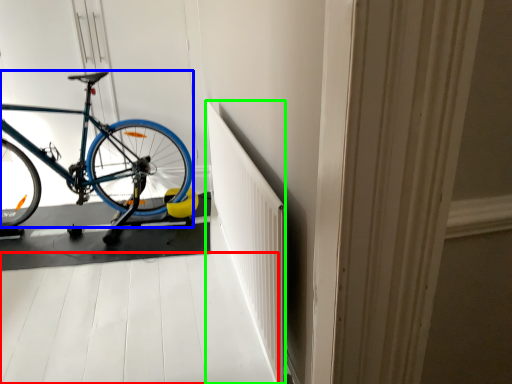
Question: Considering the real-world distances, which object is farthest from path (highlighted by a red box)? bicycle (highlighted by a blue box) or radiator (highlighted by a green box)?

Choices:
 (A) bicycle
 (B) radiator

Answer: (A)